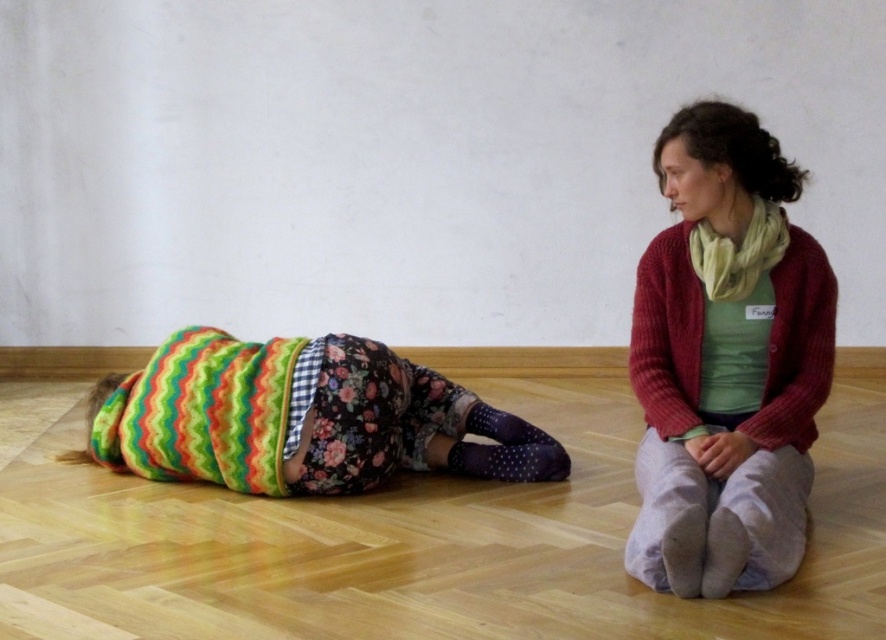
Question: Is knitted red sweater at center smaller than knitted yellow scarf at upper right?

Choices:
 (A) yes
 (B) no

Answer: (B)

Question: Considering the relative positions of multicolored knitted blanket at lower left and knitted yellow scarf at upper right in the image provided, where is multicolored knitted blanket at lower left located with respect to knitted yellow scarf at upper right?

Choices:
 (A) right
 (B) left

Answer: (B)

Question: Which object is positioned farthest from the knitted red sweater at right?

Choices:
 (A) knitted red sweater at center
 (B) knitted yellow scarf at upper right
 (C) multicolored knitted blanket at lower left

Answer: (C)

Question: Can you confirm if multicolored knitted blanket at lower left is positioned above knitted red sweater at right?

Choices:
 (A) no
 (B) yes

Answer: (A)

Question: Which point is closer to the camera?

Choices:
 (A) knitted yellow scarf at upper right
 (B) knitted red sweater at center
 (C) knitted red sweater at right
 (D) multicolored knitted blanket at lower left

Answer: (B)

Question: Which object appears farthest from the camera in this image?

Choices:
 (A) multicolored knitted blanket at lower left
 (B) knitted yellow scarf at upper right
 (C) knitted red sweater at center

Answer: (A)